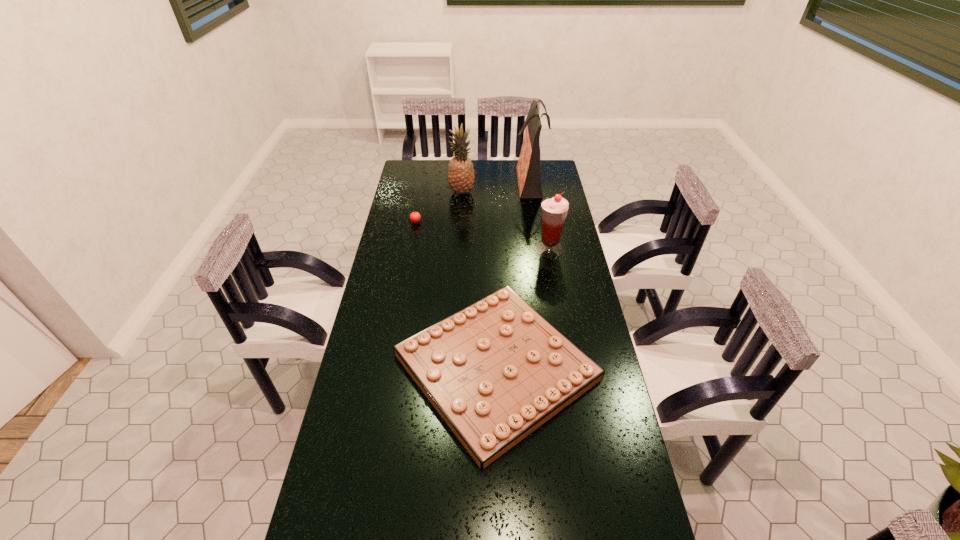
Image resolution: width=960 pixels, height=540 pixels. Find the location of `shopping bag`. shopping bag is located at coordinates (528, 167).

Locate an element on the screen. The width and height of the screenshot is (960, 540). pineapple is located at coordinates (461, 176).

At what (x,y) coordinates should I click in order to perform the action: click on smoothie. Please return your answer as a coordinate pair (x, y). The width and height of the screenshot is (960, 540). Looking at the image, I should click on (554, 210).

You are a GUI agent. You are given a task and a screenshot of the screen. Output one action in this format:
    pyautogui.click(x=<x>, y=<y>)
    Task: Click on the third shortest object
    The height and width of the screenshot is (540, 960).
    Given the screenshot: What is the action you would take?
    pos(554,210)

This screenshot has height=540, width=960. I want to click on the fourth tallest object, so click(x=415, y=217).

The width and height of the screenshot is (960, 540). Find the location of `cherry`. cherry is located at coordinates (415, 217).

Locate an element on the screen. The height and width of the screenshot is (540, 960). the shortest object is located at coordinates tap(495, 371).

Identify the location of the nearest object. (495, 371).

This screenshot has height=540, width=960. In order to click on vacant space located on the front side of the shopping bag in this screenshot , I will do `click(492, 180)`.

Where is `vacant position located on the front side of the shopping bag`? vacant position located on the front side of the shopping bag is located at coordinates 475,180.